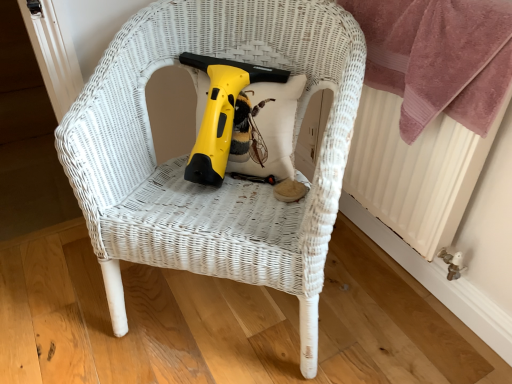
Question: Does pink plush towel at upper right have a larger size compared to white wicker chair at center?

Choices:
 (A) yes
 (B) no

Answer: (B)

Question: Does pink plush towel at upper right have a greater height compared to white wicker chair at center?

Choices:
 (A) no
 (B) yes

Answer: (A)

Question: Is pink plush towel at upper right in contact with white wicker chair at center?

Choices:
 (A) yes
 (B) no

Answer: (B)

Question: Does pink plush towel at upper right appear on the left side of white wicker chair at center?

Choices:
 (A) yes
 (B) no

Answer: (B)

Question: From a real-world perspective, is pink plush towel at upper right physically below white wicker chair at center?

Choices:
 (A) yes
 (B) no

Answer: (B)

Question: Is point (248, 142) closer or farther from the camera than point (72, 153)?

Choices:
 (A) closer
 (B) farther

Answer: (B)

Question: Is yellow plastic electric drill at center wider or thinner than white wicker chair at center?

Choices:
 (A) wide
 (B) thin

Answer: (B)

Question: Based on their sizes in the image, would you say yellow plastic electric drill at center is bigger or smaller than white wicker chair at center?

Choices:
 (A) big
 (B) small

Answer: (B)

Question: Is yellow plastic electric drill at center to the left or to the right of white wicker chair at center in the image?

Choices:
 (A) right
 (B) left

Answer: (B)

Question: From the image's perspective, is pink plush towel at upper right positioned above or below yellow plastic electric drill at center?

Choices:
 (A) above
 (B) below

Answer: (A)

Question: In the image, is pink plush towel at upper right on the left side or the right side of yellow plastic electric drill at center?

Choices:
 (A) left
 (B) right

Answer: (B)

Question: In terms of height, does pink plush towel at upper right look taller or shorter compared to yellow plastic electric drill at center?

Choices:
 (A) short
 (B) tall

Answer: (B)

Question: Considering their positions, is pink plush towel at upper right located in front of or behind yellow plastic electric drill at center?

Choices:
 (A) front
 (B) behind

Answer: (A)

Question: Is point [x=314, y=51] closer or farther from the camera than point [x=458, y=51]?

Choices:
 (A) farther
 (B) closer

Answer: (A)

Question: From a real-world perspective, is white wicker chair at center above or below pink plush towel at upper right?

Choices:
 (A) above
 (B) below

Answer: (B)